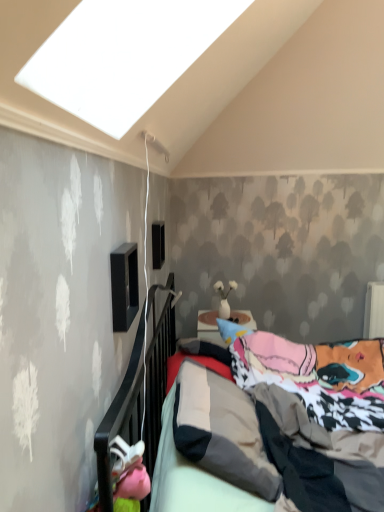
You are a GUI agent. You are given a task and a screenshot of the screen. Output one action in this format:
    pyautogui.click(x=<x>, y=<y>)
    Task: Click on the mattress at center
    The width and height of the screenshot is (384, 512).
    Given the screenshot: What is the action you would take?
    pyautogui.click(x=138, y=390)

The width and height of the screenshot is (384, 512). Describe the element at coordinates (158, 244) in the screenshot. I see `black matte window at upper center, which appears as the 1th window when viewed from the back` at that location.

You are a GUI agent. You are given a task and a screenshot of the screen. Output one action in this format:
    pyautogui.click(x=<x>, y=<y>)
    Task: Click on the black matte speaker at upper left, which ranks as the second window in back-to-front order
    
    Given the screenshot: What is the action you would take?
    pyautogui.click(x=124, y=286)

Describe the element at coordinates (124, 286) in the screenshot. I see `black matte speaker at upper left, arranged as the 1th window when viewed from the front` at that location.

You are a GUI agent. You are given a task and a screenshot of the screen. Output one action in this format:
    pyautogui.click(x=<x>, y=<y>)
    Task: Click on the mattress at center
    
    Given the screenshot: What is the action you would take?
    pyautogui.click(x=138, y=390)

Is black matte speaker at upper left, which ranks as the second window in back-to-front order, facing towards mattress at center?

No, black matte speaker at upper left, which ranks as the second window in back-to-front order, is not oriented towards mattress at center.

Between black matte speaker at upper left, arranged as the 1th window when viewed from the front, and mattress at center, which one appears on the right side from the viewer's perspective?

From the viewer's perspective, mattress at center appears more on the right side.

Considering the positions of point (121, 254) and point (147, 457), is point (121, 254) closer or farther from the camera than point (147, 457)?

Point (121, 254).

Locate an element on the screen. This screenshot has width=384, height=512. bed beneath the black matte speaker at upper left, arranged as the 1th window when viewed from the front (from a real-world perspective) is located at coordinates (138, 390).

Measure the distance from black matte window at upper center, which appears as the 1th window when viewed from the back, to black matte speaker at upper left, which ranks as the second window in back-to-front order.

The distance of black matte window at upper center, which appears as the 1th window when viewed from the back, from black matte speaker at upper left, which ranks as the second window in back-to-front order, is 1.05 meters.

Is there a large distance between black matte window at upper center, which is the 2th window in front-to-back order, and black matte speaker at upper left, arranged as the 1th window when viewed from the front?

That's right, there is a large distance between black matte window at upper center, which is the 2th window in front-to-back order, and black matte speaker at upper left, arranged as the 1th window when viewed from the front.

Locate an element on the screen. window below the black matte window at upper center, which appears as the 1th window when viewed from the back (from the image's perspective) is located at coordinates (124, 286).

From a real-world perspective, between black matte window at upper center, which is the 2th window in front-to-back order, and black matte speaker at upper left, which ranks as the second window in back-to-front order, who is vertically lower?

black matte speaker at upper left, which ranks as the second window in back-to-front order, from a real-world perspective.

Is mattress at center directly adjacent to black matte window at upper center, which appears as the 1th window when viewed from the back?

No.

Which of these two, mattress at center or black matte window at upper center, which appears as the 1th window when viewed from the back, stands shorter?

black matte window at upper center, which appears as the 1th window when viewed from the back, is shorter.

Identify the location of the 2nd window behind the mattress at center, counting from the anchor's position. Image resolution: width=384 pixels, height=512 pixels. click(158, 244).

From a real-world perspective, who is located lower, mattress at center or black matte window at upper center, which appears as the 1th window when viewed from the back?

mattress at center, from a real-world perspective.

Are black matte window at upper center, which is the 2th window in front-to-back order, and mattress at center located far from each other?

No, black matte window at upper center, which is the 2th window in front-to-back order, is not far from mattress at center.

Which object is thinner, black matte window at upper center, which appears as the 1th window when viewed from the back, or mattress at center?

With smaller width is black matte window at upper center, which appears as the 1th window when viewed from the back.

Is black matte window at upper center, which is the 2th window in front-to-back order, positioned beyond the bounds of mattress at center?

Yes.

Does black matte window at upper center, which is the 2th window in front-to-back order, have a greater height compared to mattress at center?

No.

Is black matte window at upper center, which appears as the 1th window when viewed from the back, at the back of black matte speaker at upper left, which ranks as the second window in back-to-front order?

No, black matte speaker at upper left, which ranks as the second window in back-to-front order, is not facing the opposite direction of black matte window at upper center, which appears as the 1th window when viewed from the back.

Is black matte speaker at upper left, which ranks as the second window in back-to-front order, surrounding black matte window at upper center, which is the 2th window in front-to-back order?

No, black matte speaker at upper left, which ranks as the second window in back-to-front order, does not contain black matte window at upper center, which is the 2th window in front-to-back order.

Is black matte speaker at upper left, arranged as the 1th window when viewed from the front, at the right side of black matte window at upper center, which appears as the 1th window when viewed from the back?

Incorrect, black matte speaker at upper left, arranged as the 1th window when viewed from the front, is not on the right side of black matte window at upper center, which appears as the 1th window when viewed from the back.

Is mattress at center not inside black matte speaker at upper left, which ranks as the second window in back-to-front order?

Yes, mattress at center is not within black matte speaker at upper left, which ranks as the second window in back-to-front order.

Is mattress at center not close to black matte speaker at upper left, which ranks as the second window in back-to-front order?

No, mattress at center is not far from black matte speaker at upper left, which ranks as the second window in back-to-front order.

Locate an element on the screen. bed below the black matte speaker at upper left, arranged as the 1th window when viewed from the front (from the image's perspective) is located at coordinates (138, 390).

Locate an element on the screen. Image resolution: width=384 pixels, height=512 pixels. window lying on the right of black matte speaker at upper left, arranged as the 1th window when viewed from the front is located at coordinates (158, 244).

Looking at the image, which one is located further to black matte speaker at upper left, which ranks as the second window in back-to-front order, mattress at center or black matte window at upper center, which appears as the 1th window when viewed from the back?

Among the two, black matte window at upper center, which appears as the 1th window when viewed from the back, is located further to black matte speaker at upper left, which ranks as the second window in back-to-front order.

Consider the image. Considering their positions, is black matte window at upper center, which appears as the 1th window when viewed from the back, positioned further to black matte speaker at upper left, arranged as the 1th window when viewed from the front, than mattress at center?

black matte window at upper center, which appears as the 1th window when viewed from the back, is positioned further to the anchor black matte speaker at upper left, arranged as the 1th window when viewed from the front.

Looking at the image, which one is located further to black matte window at upper center, which appears as the 1th window when viewed from the back, black matte speaker at upper left, arranged as the 1th window when viewed from the front, or mattress at center?

The object further to black matte window at upper center, which appears as the 1th window when viewed from the back, is black matte speaker at upper left, arranged as the 1th window when viewed from the front.

From the image, which object appears to be farther from black matte window at upper center, which appears as the 1th window when viewed from the back, mattress at center or black matte speaker at upper left, arranged as the 1th window when viewed from the front?

black matte speaker at upper left, arranged as the 1th window when viewed from the front.

Which object lies nearer to the anchor point mattress at center, black matte window at upper center, which appears as the 1th window when viewed from the back, or black matte speaker at upper left, arranged as the 1th window when viewed from the front?

Among the two, black matte speaker at upper left, arranged as the 1th window when viewed from the front, is located nearer to mattress at center.

Considering their positions, is black matte speaker at upper left, arranged as the 1th window when viewed from the front, positioned further to mattress at center than black matte window at upper center, which appears as the 1th window when viewed from the back?

black matte window at upper center, which appears as the 1th window when viewed from the back, lies further to mattress at center than the other object.

The width and height of the screenshot is (384, 512). Find the location of `window positioned between mattress at center and black matte window at upper center, which appears as the 1th window when viewed from the back, from near to far`. window positioned between mattress at center and black matte window at upper center, which appears as the 1th window when viewed from the back, from near to far is located at coordinates (124, 286).